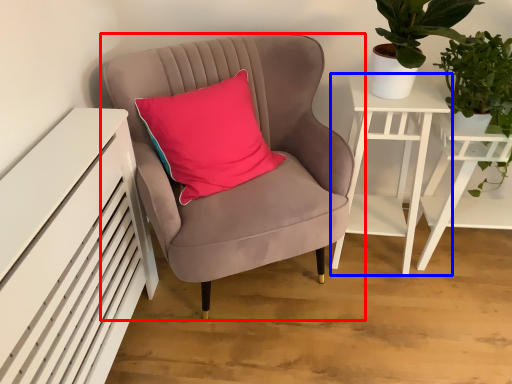
Question: Which point is closer to the camera, chair (highlighted by a red box) or nightstand (highlighted by a blue box)?

Choices:
 (A) chair
 (B) nightstand

Answer: (A)